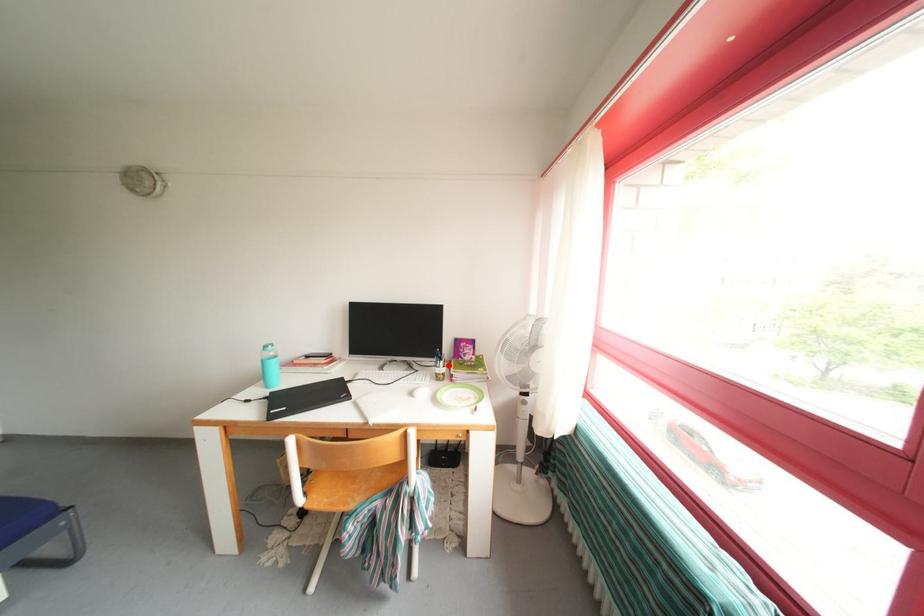
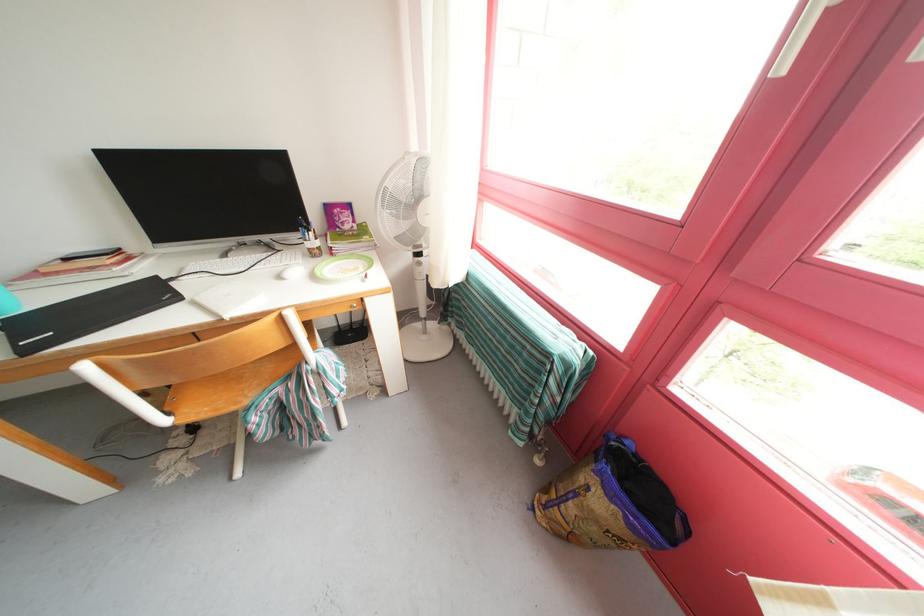
In the second image, find the point that corresponds to the highlighted location in the first image.

(315, 236)